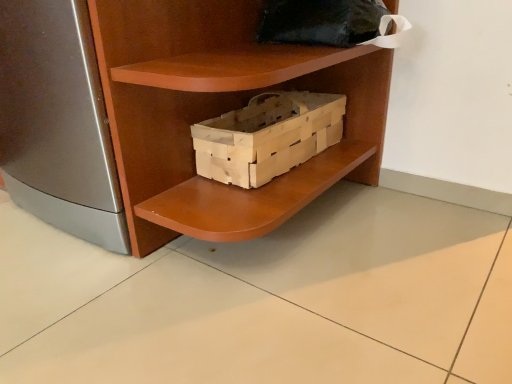
Question: Looking at their shapes, would you say wooden crate at center is wider or thinner than wooden crate at center?

Choices:
 (A) thin
 (B) wide

Answer: (A)

Question: Is wooden crate at center inside the boundaries of wooden crate at center, or outside?

Choices:
 (A) outside
 (B) inside

Answer: (A)

Question: Which is nearer to the wooden crate at center?

Choices:
 (A) wooden crate at center
 (B) black fabric pillow at upper center

Answer: (A)

Question: Estimate the real-world distances between objects in this image. Which object is farther from the wooden crate at center?

Choices:
 (A) wooden crate at center
 (B) black fabric pillow at upper center

Answer: (B)